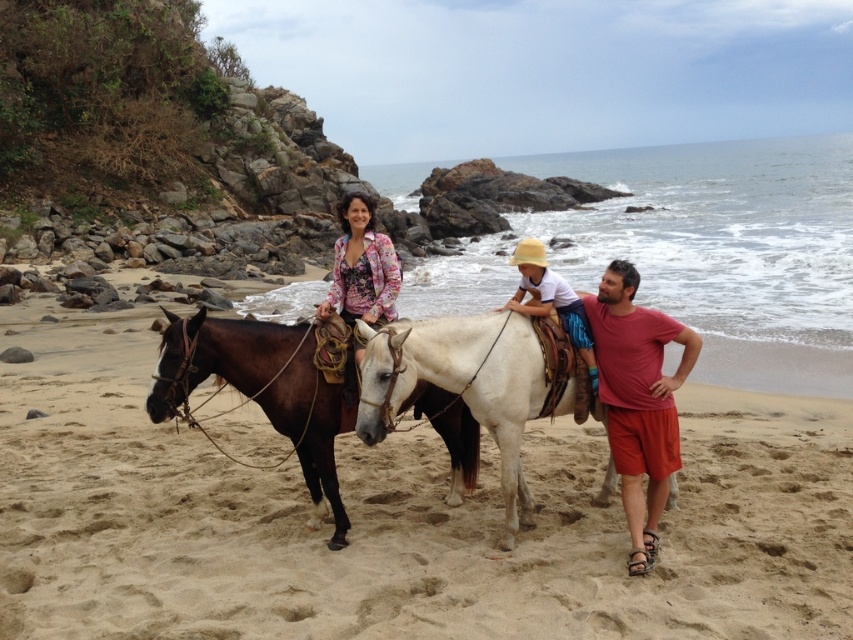
You are a photographer planning to take a group photo of the shiny brown horse at center and the white leather horse at center. Based on their sizes, which horse should you position closer to the camera to make them appear the same size in the photo?

The shiny brown horse at center is larger in size than the white leather horse at center, so to make them appear the same size in the photo, you should position the smaller white leather horse at center closer to the camera than the larger shiny brown horse at center.

You are a photographer standing at the origin point of the coordinate system. You want to capture a photo of the brown leather horse at center. What are the coordinates where you should aim your camera?

The coordinates to aim your camera are at point (x=263, y=392) to capture the brown leather horse at center.